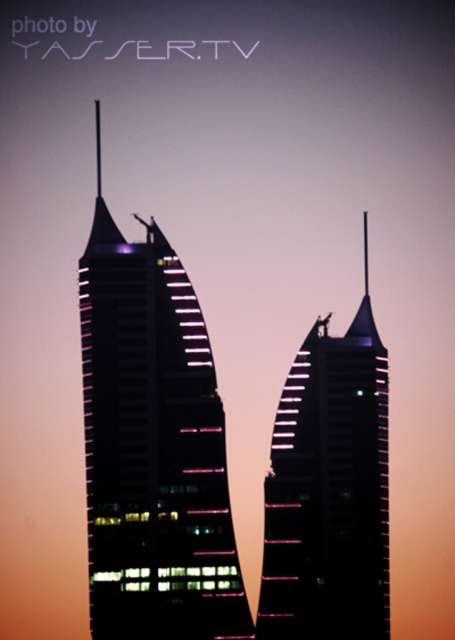
Consider the image. You are a drone operator who needs to fly a drone between the two skyscrapers. The drone has a wingspan of 3 meters. Based on the scene, can the drone safely pass through the gap between the matte glass skyscraper at center and the black glass skyscraper at center?

The distance between the matte glass skyscraper at center and the black glass skyscraper at center is 36.12 meters. Since the drone has a wingspan of 3 meters, there is ample space for it to safely pass through the gap between the two skyscrapers.

You are an architect analyzing the image of two skyscrapers. Which skyscraper, the matte glass skyscraper at center or the black glass skyscraper at center, appears closer to you based on their spatial arrangement?

The matte glass skyscraper at center appears closer because it is positioned over the black glass skyscraper at center, indicating it is in front.